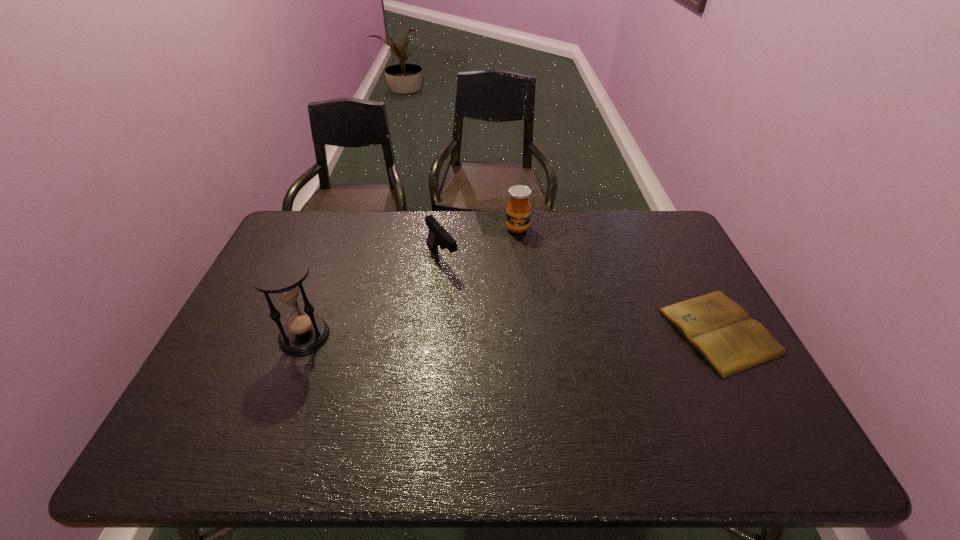
Locate an element on the screen. vacant space on the desktop that is between the leftmost object and the book and is positioned on the front-facing side of the second farthest object is located at coordinates tap(506, 333).

This screenshot has height=540, width=960. Find the location of `free space on the desktop that is between the tallest object and the rightmost object and is positioned on the front-facing side of the third shortest object`. free space on the desktop that is between the tallest object and the rightmost object and is positioned on the front-facing side of the third shortest object is located at coordinates (532, 333).